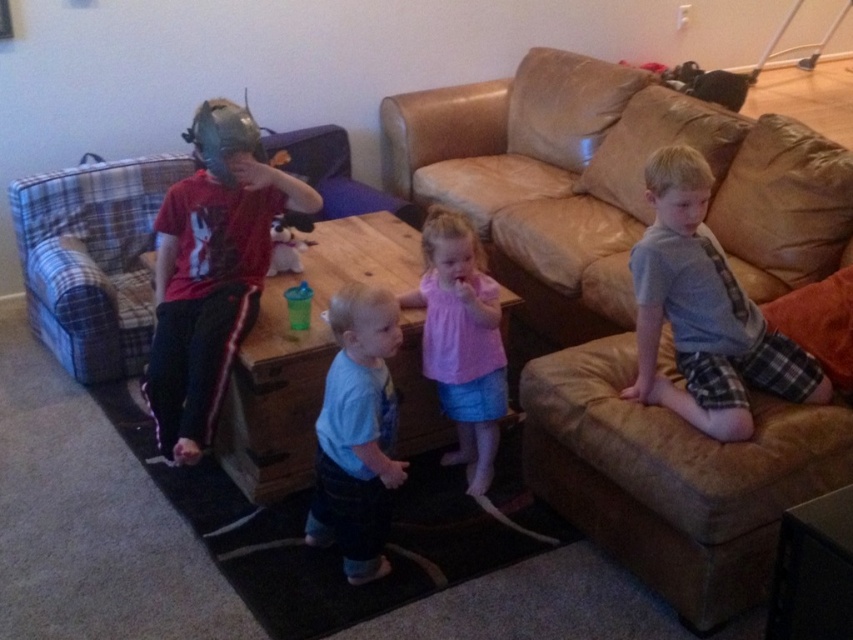
Which is behind, point (221, 300) or point (381, 540)?

Point (221, 300)

Is matte red shirt at left above blue cotton shirt at center?

Yes.

Find the location of a particular element. matte red shirt at left is located at coordinates (212, 272).

The image size is (853, 640). I want to click on matte red shirt at left, so (x=212, y=272).

Who is more forward, (149, 164) or (456, 323)?

Point (456, 323) is more forward.

Does blue plaid couch at left have a smaller size compared to pink cotton shirt at center?

Incorrect, blue plaid couch at left is not smaller in size than pink cotton shirt at center.

Which is in front, point (352, 202) or point (428, 237)?

Point (428, 237) is more forward.

Where is `blue plaid couch at left`? blue plaid couch at left is located at coordinates (91, 259).

Who is more distant from viewer, (x=807, y=362) or (x=376, y=420)?

Point (x=807, y=362)

Can you confirm if gray flannel shirt at right is thinner than blue cotton shirt at center?

In fact, gray flannel shirt at right might be wider than blue cotton shirt at center.

Is point (700, 308) positioned before point (339, 397)?

No.

This screenshot has height=640, width=853. What are the coordinates of `gray flannel shirt at right` in the screenshot? It's located at (704, 312).